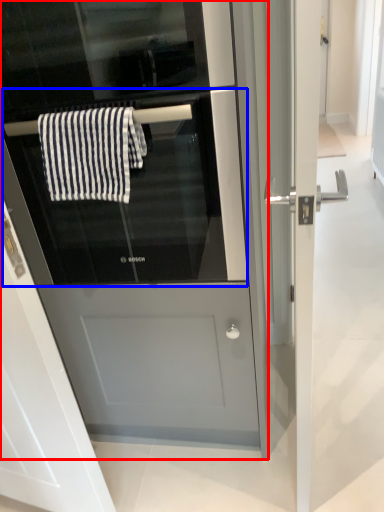
Question: Which of the following is the closest to the observer, fridge (highlighted by a red box) or oven (highlighted by a blue box)?

Choices:
 (A) fridge
 (B) oven

Answer: (A)